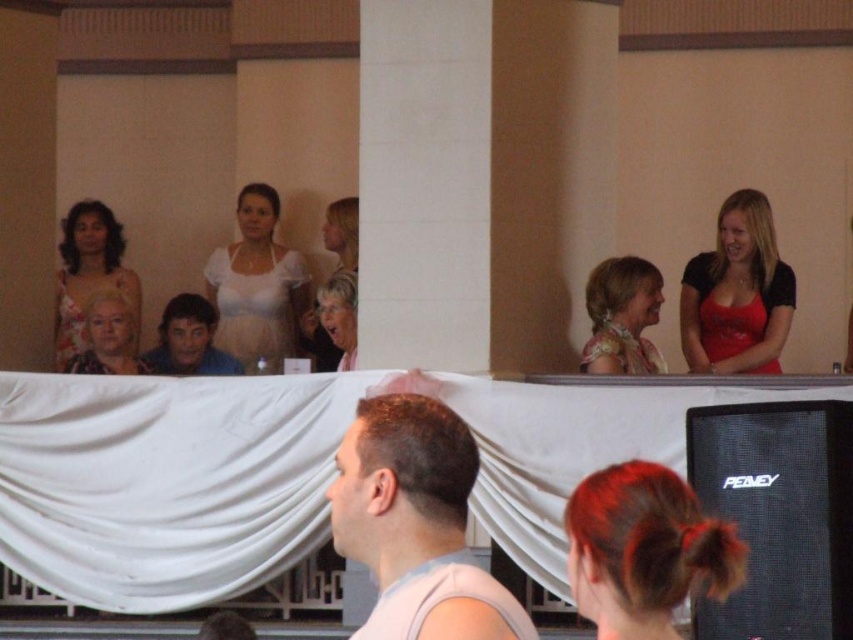
Is gray matte tank top at center positioned in front of dark brown hair bun at lower center?

No.

The image size is (853, 640). What are the coordinates of `gray matte tank top at center` in the screenshot? It's located at (416, 524).

Does dark brown hair bun at lower center come in front of shiny blue shirt at center?

That is True.

Does point (657, 467) come behind point (167, 332)?

No.

Identify the location of dark brown hair bun at lower center. (643, 548).

You are a GUI agent. You are given a task and a screenshot of the screen. Output one action in this format:
    pyautogui.click(x=<x>, y=<y>)
    Task: Click on the dark brown hair bun at lower center
    This screenshot has width=853, height=640.
    Given the screenshot: What is the action you would take?
    pyautogui.click(x=643, y=548)

Is point (625, 276) positioned in front of point (190, 326)?

That is True.

Is point (595, 355) positioned in front of point (193, 326)?

Yes, it is.

Where is `floral-patterned blouse at upper center`? floral-patterned blouse at upper center is located at coordinates (621, 316).